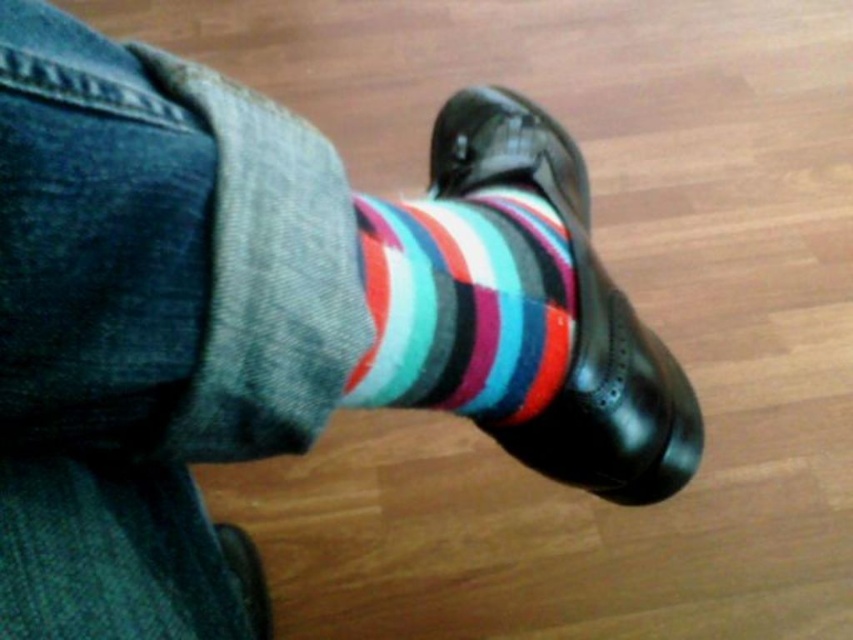
Question: Which object is farther from the camera taking this photo?

Choices:
 (A) shiny black shoe at center
 (B) multicolored striped sock at lower center

Answer: (A)

Question: Can you confirm if multicolored striped sock at lower center is smaller than shiny black shoe at center?

Choices:
 (A) yes
 (B) no

Answer: (A)

Question: Which point is closer to the camera?

Choices:
 (A) (659, 368)
 (B) (517, 232)

Answer: (B)

Question: Can you confirm if multicolored striped sock at lower center is positioned above shiny black shoe at center?

Choices:
 (A) yes
 (B) no

Answer: (B)

Question: Is multicolored striped sock at lower center bigger than shiny black shoe at center?

Choices:
 (A) no
 (B) yes

Answer: (A)